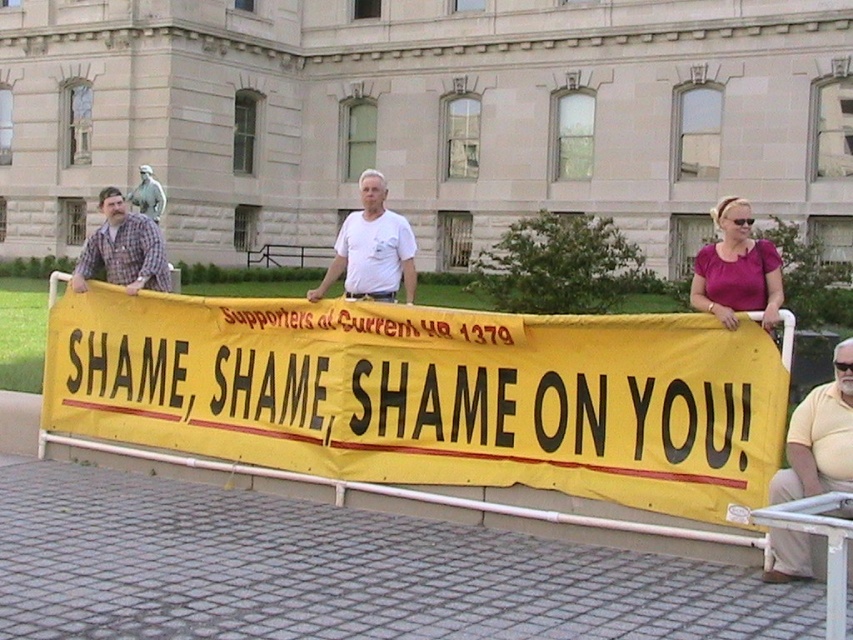
Question: Which of the following is the closest to the observer?

Choices:
 (A) (399, 273)
 (B) (109, 390)
 (C) (705, 275)
 (D) (134, 280)

Answer: (C)

Question: Does yellow fabric banner at center come in front of purple satin blouse at upper right?

Choices:
 (A) no
 (B) yes

Answer: (B)

Question: Which point appears closest to the camera in this image?

Choices:
 (A) (785, 452)
 (B) (722, 308)
 (C) (393, 272)

Answer: (A)

Question: Can you confirm if purple satin blouse at upper right is wider than white matte t-shirt at center?

Choices:
 (A) yes
 (B) no

Answer: (A)

Question: Which point is farther to the camera?

Choices:
 (A) white matte t-shirt at center
 (B) plaid fabric shirt at left

Answer: (B)

Question: Does purple satin blouse at upper right come in front of plaid fabric shirt at left?

Choices:
 (A) yes
 (B) no

Answer: (A)